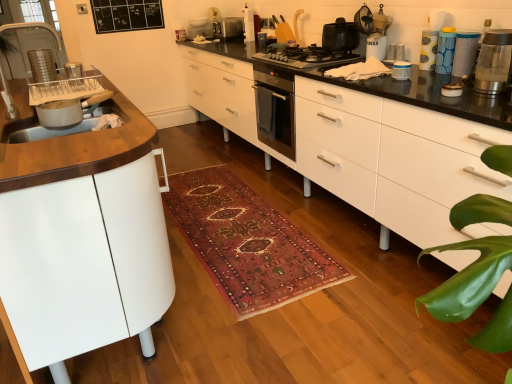
Locate an element on the screen. vacant space in front of yellow paper towel dispenser at upper right, which ranks as the 3th appliance in back-to-front order is located at coordinates (437, 69).